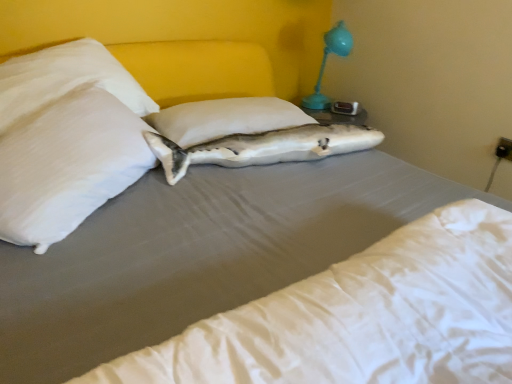
What do you see at coordinates (325, 63) in the screenshot? I see `matte blue plastic lamp at upper right` at bounding box center [325, 63].

Measure the distance between white fabric pillow at center, the first pillow in the right-to-left sequence, and camera.

white fabric pillow at center, the first pillow in the right-to-left sequence, and camera are 5.03 feet apart.

What do you see at coordinates (225, 119) in the screenshot? Image resolution: width=512 pixels, height=384 pixels. I see `white fabric pillow at center, the first pillow in the right-to-left sequence` at bounding box center [225, 119].

Locate an element on the screen. The width and height of the screenshot is (512, 384). white matte fish at center is located at coordinates [263, 147].

What do you see at coordinates (362, 316) in the screenshot?
I see `white smooth mattress at center` at bounding box center [362, 316].

At what (x,y) coordinates should I click in order to perform the action: click on matte blue plastic lamp at upper right. Please return your answer as a coordinate pair (x, y). The image size is (512, 384). Looking at the image, I should click on (325, 63).

Would you say white fabric pillow at center, the 2th pillow from the left, is inside or outside white satin pillow at upper left, arranged as the 1th pillow when viewed from the left?

white fabric pillow at center, the 2th pillow from the left, is not inside white satin pillow at upper left, arranged as the 1th pillow when viewed from the left, it's outside.

Consider the image. Can you see white fabric pillow at center, the 2th pillow from the left, touching white satin pillow at upper left, arranged as the 1th pillow when viewed from the left?

white fabric pillow at center, the 2th pillow from the left, and white satin pillow at upper left, arranged as the 1th pillow when viewed from the left, are not in contact.

Considering the sizes of objects white fabric pillow at center, the 2th pillow from the left, and white satin pillow at upper left, arranged as the 1th pillow when viewed from the left, in the image provided, who is thinner, white fabric pillow at center, the 2th pillow from the left, or white satin pillow at upper left, arranged as the 1th pillow when viewed from the left,?

Thinner between the two is white satin pillow at upper left, arranged as the 1th pillow when viewed from the left.

From the image's perspective, is white fabric pillow at center, the first pillow in the right-to-left sequence, above or below white satin pillow at upper left, arranged as the 1th pillow when viewed from the left?

Clearly, from the image's perspective, white fabric pillow at center, the first pillow in the right-to-left sequence, is above white satin pillow at upper left, arranged as the 1th pillow when viewed from the left.

Could you tell me if white fabric pillow at center, the 2th pillow from the left, is facing matte blue plastic lamp at upper right?

No, white fabric pillow at center, the 2th pillow from the left, does not turn towards matte blue plastic lamp at upper right.

Can you confirm if white fabric pillow at center, the 2th pillow from the left, is thinner than matte blue plastic lamp at upper right?

No, white fabric pillow at center, the 2th pillow from the left, is not thinner than matte blue plastic lamp at upper right.

Are white fabric pillow at center, the first pillow in the right-to-left sequence, and matte blue plastic lamp at upper right beside each other?

No, white fabric pillow at center, the first pillow in the right-to-left sequence, is not making contact with matte blue plastic lamp at upper right.

Is white fabric pillow at center, the 2th pillow from the left, smaller than matte blue plastic lamp at upper right?

Yes.

From a real-world perspective, is matte blue plastic lamp at upper right positioned above or below white fabric pillow at center, the first pillow in the right-to-left sequence?

matte blue plastic lamp at upper right is situated higher than white fabric pillow at center, the first pillow in the right-to-left sequence, in the real world.

Is matte blue plastic lamp at upper right to the left or to the right of white fabric pillow at center, the first pillow in the right-to-left sequence, in the image?

matte blue plastic lamp at upper right is to the right of white fabric pillow at center, the first pillow in the right-to-left sequence.

Who is smaller, matte blue plastic lamp at upper right or white matte fish at center?

white matte fish at center is smaller.

How far apart are matte blue plastic lamp at upper right and white matte fish at center?

A distance of 32.63 inches exists between matte blue plastic lamp at upper right and white matte fish at center.

Does matte blue plastic lamp at upper right have a greater height compared to white matte fish at center?

Correct, matte blue plastic lamp at upper right is much taller as white matte fish at center.

Based on the photo, which is more to the right, matte blue plastic lamp at upper right or white matte fish at center?

From the viewer's perspective, matte blue plastic lamp at upper right appears more on the right side.

Could you measure the distance between matte blue plastic lamp at upper right and white satin pillow at upper left, arranged as the 1th pillow when viewed from the left?

The distance of matte blue plastic lamp at upper right from white satin pillow at upper left, arranged as the 1th pillow when viewed from the left, is 1.38 meters.

Is matte blue plastic lamp at upper right not close to white satin pillow at upper left, arranged as the 2th pillow when viewed from the right?

matte blue plastic lamp at upper right is positioned a significant distance from white satin pillow at upper left, arranged as the 2th pillow when viewed from the right.

Looking at the image, does matte blue plastic lamp at upper right seem bigger or smaller compared to white satin pillow at upper left, arranged as the 2th pillow when viewed from the right?

Clearly, matte blue plastic lamp at upper right is smaller in size than white satin pillow at upper left, arranged as the 2th pillow when viewed from the right.

From the picture: Is matte blue plastic lamp at upper right inside or outside of white satin pillow at upper left, arranged as the 2th pillow when viewed from the right?

matte blue plastic lamp at upper right is not enclosed by white satin pillow at upper left, arranged as the 2th pillow when viewed from the right.

Does point (212, 108) come farther from viewer compared to point (375, 137)?

That is True.

Based on the photo, do you think white fabric pillow at center, the first pillow in the right-to-left sequence, is within white matte fish at center, or outside of it?

The correct answer is: outside.

Can you confirm if white fabric pillow at center, the first pillow in the right-to-left sequence, is wider than white matte fish at center?

Correct, the width of white fabric pillow at center, the first pillow in the right-to-left sequence, exceeds that of white matte fish at center.

How many degrees apart are the facing directions of white fabric pillow at center, the first pillow in the right-to-left sequence, and white matte fish at center?

7.92 degrees separate the facing orientations of white fabric pillow at center, the first pillow in the right-to-left sequence, and white matte fish at center.

From a real-world perspective, is white smooth mattress at center below white satin pillow at upper left, arranged as the 2th pillow when viewed from the right?

Yes.

Which of these two, white smooth mattress at center or white satin pillow at upper left, arranged as the 1th pillow when viewed from the left, is smaller?

white smooth mattress at center.

Does white smooth mattress at center appear on the right side of white satin pillow at upper left, arranged as the 1th pillow when viewed from the left?

Correct, you'll find white smooth mattress at center to the right of white satin pillow at upper left, arranged as the 1th pillow when viewed from the left.

Does white smooth mattress at center have a greater height compared to white satin pillow at upper left, arranged as the 1th pillow when viewed from the left?

In fact, white smooth mattress at center may be shorter than white satin pillow at upper left, arranged as the 1th pillow when viewed from the left.

The width and height of the screenshot is (512, 384). What are the coordinates of `pillow that appears on the right of white satin pillow at upper left, arranged as the 2th pillow when viewed from the right` in the screenshot? It's located at (225, 119).

This screenshot has width=512, height=384. Find the location of `the 1st pillow to the left of the matte blue plastic lamp at upper right, starting your count from the anchor`. the 1st pillow to the left of the matte blue plastic lamp at upper right, starting your count from the anchor is located at coordinates (225, 119).

Which object lies nearer to the anchor point white smooth mattress at center, white satin pillow at upper left, arranged as the 2th pillow when viewed from the right, or white matte fish at center?

white satin pillow at upper left, arranged as the 2th pillow when viewed from the right, is positioned closer to the anchor white smooth mattress at center.

From the image, which object appears to be nearer to matte blue plastic lamp at upper right, white smooth mattress at center or white fabric pillow at center, the 2th pillow from the left?

white fabric pillow at center, the 2th pillow from the left, is closer to matte blue plastic lamp at upper right.

Which object lies nearer to the anchor point white fabric pillow at center, the first pillow in the right-to-left sequence, white smooth mattress at center or matte blue plastic lamp at upper right?

Among the two, matte blue plastic lamp at upper right is located nearer to white fabric pillow at center, the first pillow in the right-to-left sequence.

Considering their positions, is white fabric pillow at center, the 2th pillow from the left, positioned closer to white matte fish at center than white satin pillow at upper left, arranged as the 1th pillow when viewed from the left?

white fabric pillow at center, the 2th pillow from the left, lies closer to white matte fish at center than the other object.

When comparing their distances from white matte fish at center, does matte blue plastic lamp at upper right or white fabric pillow at center, the first pillow in the right-to-left sequence, seem further?

Among the two, matte blue plastic lamp at upper right is located further to white matte fish at center.

When comparing their distances from white satin pillow at upper left, arranged as the 2th pillow when viewed from the right, does white fabric pillow at center, the 2th pillow from the left, or white smooth mattress at center seem closer?

Among the two, white fabric pillow at center, the 2th pillow from the left, is located nearer to white satin pillow at upper left, arranged as the 2th pillow when viewed from the right.

Estimate the real-world distances between objects in this image. Which object is further from white fabric pillow at center, the first pillow in the right-to-left sequence, white matte fish at center or white satin pillow at upper left, arranged as the 2th pillow when viewed from the right?

Based on the image, white satin pillow at upper left, arranged as the 2th pillow when viewed from the right, appears to be further to white fabric pillow at center, the first pillow in the right-to-left sequence.

Which object lies further to the anchor point matte blue plastic lamp at upper right, white fabric pillow at center, the first pillow in the right-to-left sequence, or white smooth mattress at center?

white smooth mattress at center lies further to matte blue plastic lamp at upper right than the other object.

Find the location of a particular element. pillow between white satin pillow at upper left, arranged as the 2th pillow when viewed from the right, and white matte fish at center, in the horizontal direction is located at coordinates (225, 119).

Where is `pillow between white smooth mattress at center and white matte fish at center along the z-axis`? Image resolution: width=512 pixels, height=384 pixels. pillow between white smooth mattress at center and white matte fish at center along the z-axis is located at coordinates (68, 165).

Find the location of a particular element. Image resolution: width=512 pixels, height=384 pixels. fish between white satin pillow at upper left, arranged as the 1th pillow when viewed from the left, and matte blue plastic lamp at upper right in the front-back direction is located at coordinates (263, 147).

You are a GUI agent. You are given a task and a screenshot of the screen. Output one action in this format:
    pyautogui.click(x=<x>, y=<y>)
    Task: Click on the fish positioned between white smooth mattress at center and white fabric pillow at center, the first pillow in the right-to-left sequence, from near to far
    The image size is (512, 384).
    Given the screenshot: What is the action you would take?
    pyautogui.click(x=263, y=147)